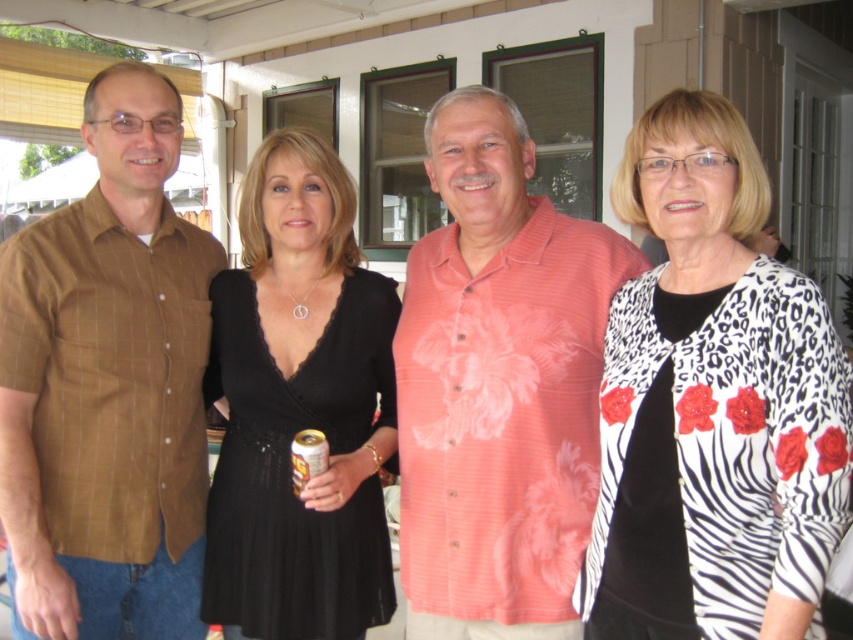
Based on the photo, who is higher up, brown plaid shirt at left or pink floral shirt at center?

Positioned higher is brown plaid shirt at left.

Is brown plaid shirt at left smaller than pink floral shirt at center?

No.

Is point (199, 256) positioned after point (512, 355)?

Yes.

This screenshot has height=640, width=853. Identify the location of brown plaid shirt at left. (107, 387).

Which of these two, white zebra print cardigan at right or pink floral shirt at center, stands shorter?

Standing shorter between the two is white zebra print cardigan at right.

Is white zebra print cardigan at right smaller than pink floral shirt at center?

Correct, white zebra print cardigan at right occupies less space than pink floral shirt at center.

Between point (730, 561) and point (566, 548), which one is positioned in front?

Point (730, 561) is more forward.

Locate an element on the screen. Image resolution: width=853 pixels, height=640 pixels. white zebra print cardigan at right is located at coordinates (712, 404).

Is point (90, 515) less distant than point (294, 454)?

No, it is not.

Can you confirm if brown plaid shirt at left is thinner than gold metallic can at center?

Incorrect, brown plaid shirt at left's width is not less than gold metallic can at center's.

What do you see at coordinates (107, 387) in the screenshot? This screenshot has height=640, width=853. I see `brown plaid shirt at left` at bounding box center [107, 387].

Where is `brown plaid shirt at left`? This screenshot has height=640, width=853. brown plaid shirt at left is located at coordinates (107, 387).